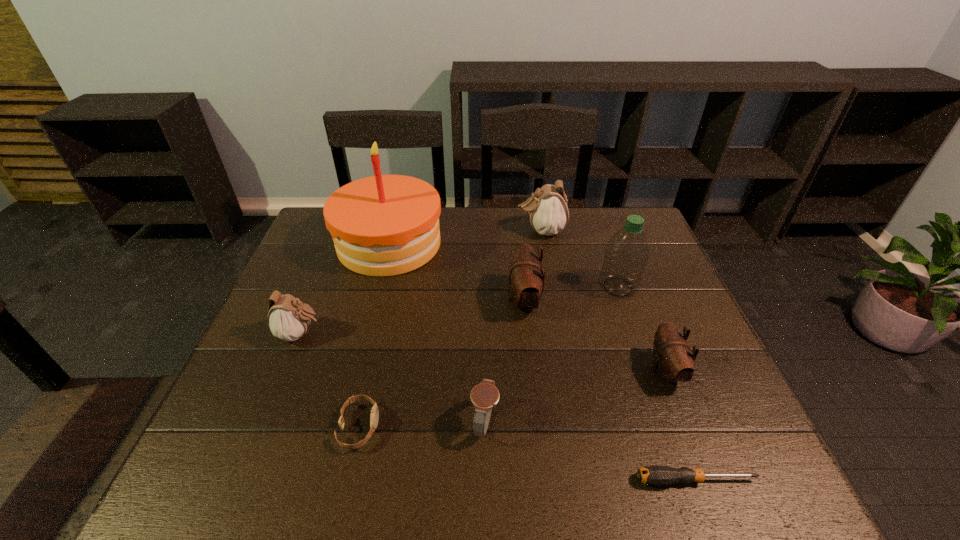
This screenshot has height=540, width=960. Find the location of `screwdriver present at the right edge`. screwdriver present at the right edge is located at coordinates (651, 475).

Where is `object at the far left corner`? The image size is (960, 540). object at the far left corner is located at coordinates (384, 225).

At what (x,y) coordinates should I click in order to perform the action: click on object that is positioned at the near right corner. Please return your answer as a coordinate pair (x, y). Looking at the image, I should click on (651, 475).

Locate an element on the screen. free spot at the far edge of the desktop is located at coordinates (528, 211).

Where is `vacant space at the near edge`? This screenshot has width=960, height=540. vacant space at the near edge is located at coordinates (328, 451).

Locate an element on the screen. vacant space at the left edge of the desktop is located at coordinates point(251,365).

In the image, there is a desktop. In order to click on free space at the right edge in this screenshot , I will do `click(664, 266)`.

Where is `free space at the far left corner of the desktop`? This screenshot has height=540, width=960. free space at the far left corner of the desktop is located at coordinates (324, 226).

Image resolution: width=960 pixels, height=540 pixels. Find the location of `vacant space at the near right corner of the desktop`. vacant space at the near right corner of the desktop is located at coordinates (715, 490).

At what (x,y) coordinates should I click in order to perform the action: click on vacant area that lies between the screwdriver and the left brown pouch. Please return your answer as a coordinate pair (x, y). Looking at the image, I should click on (610, 390).